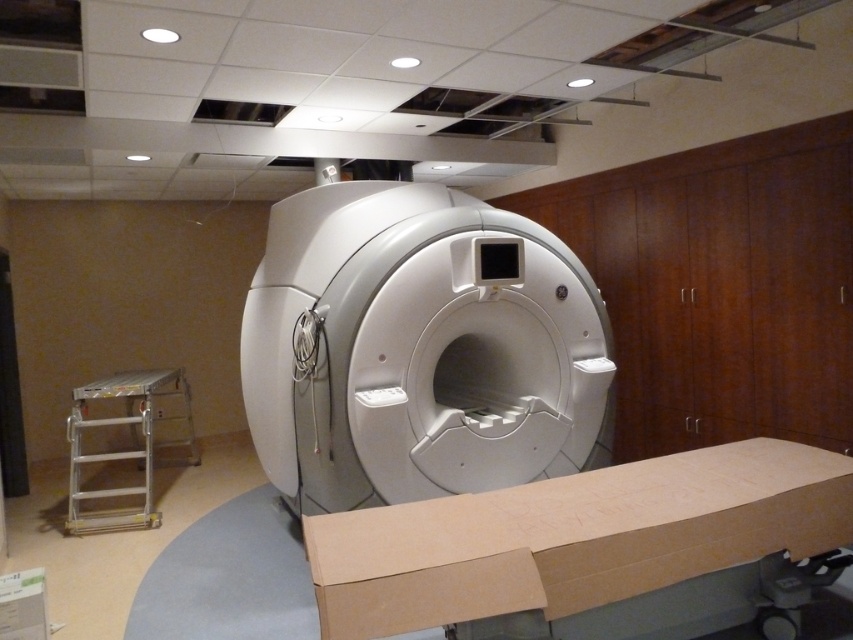
You are a technician in a medical facility. You need to place a new equipment in the room where the MRI scanner is located. The MRI scanner is at point (418, 348). Where should you place the new equipment so that it is exactly 0.1 units to the right of the MRI scanner?

The new equipment should be placed at point 0.645, 0.491, which is exactly 0.1 units to the right of the white plastic mri scanner at center located at (418, 348).

You are a technician standing at the entrance of the MRI room. You need to move a cart that is 1.5 meters long into the room. The entrance is directly behind you. Can you safely maneuver the cart into the room without hitting the white plastic mri scanner at center?

The white plastic mri scanner at center is 3.43 meters away from the camera. Since the entrance is behind you, and the scanner is at the center, there should be enough space to maneuver the 1.5 meter long cart into the room without hitting the scanner, provided the path is clear.

You are a technician moving the silver metallic ladder at lower left into position near the white plastic mri scanner at center. Considering their sizes, will the ladder fit without needing to be disassembled?

The white plastic mri scanner at center is larger than the silver metallic ladder at lower left, so the ladder can fit near the scanner without needing to be disassembled.